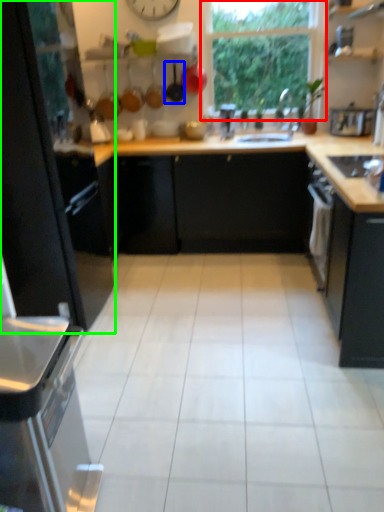
Question: Which object is the closest to the window (highlighted by a red box)? Choose among these: frying pan (highlighted by a blue box) or cabinetry (highlighted by a green box).

Choices:
 (A) frying pan
 (B) cabinetry

Answer: (A)